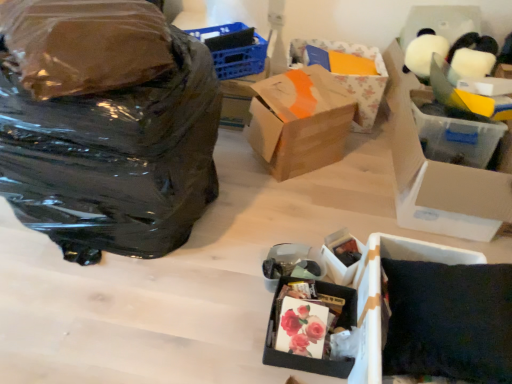
Find the location of `vacant space in between black plastic bag at left and matte black box at lower center, which appears as the first box when ordered from the bottom`. vacant space in between black plastic bag at left and matte black box at lower center, which appears as the first box when ordered from the bottom is located at coordinates (208, 264).